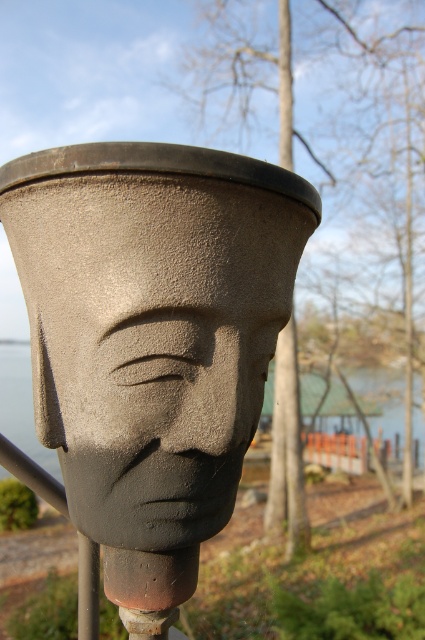
You are standing in front of the sculpted head on the pole. You notice two points marked on the sculpture. The first point is at coordinates point (65, 307) and the second point is at point (56, 476). Which point is closer to you?

Point (65, 307) is in front of point (56, 476), so the first point is closer to you.

You are standing in front of a sculpture and want to touch both the matte gray stone head at center and the gray stone water at center. Based on their positions, which one would you need to reach out further to touch?

The gray stone water at center is further away from the viewer than the matte gray stone head at center, so you would need to reach out further to touch the gray stone water at center.

You are an artist planning to paint the scene. You need to decide which object, the matte gray stone head at center or the gray stone water at center, should be placed higher in your painting to match the original image. Which one should you choose?

The matte gray stone head at center is positioned over gray stone water at center, so you should place the matte gray stone head at center higher than the gray stone water at center in your painting.